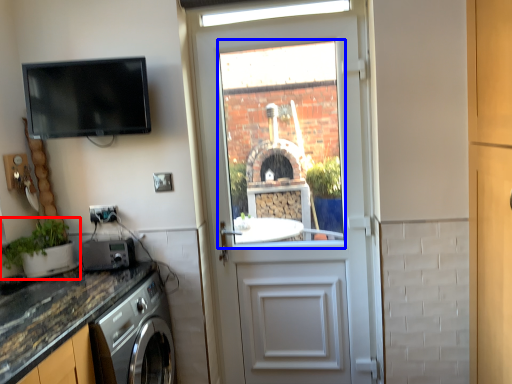
Question: Which point is closer to the camera, houseplant (highlighted by a red box) or window (highlighted by a blue box)?

Choices:
 (A) houseplant
 (B) window

Answer: (A)